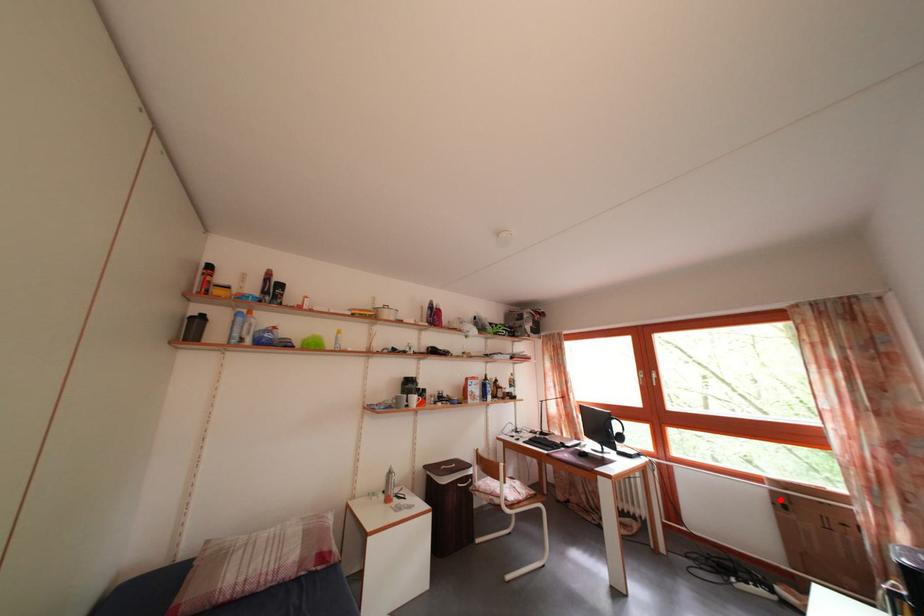
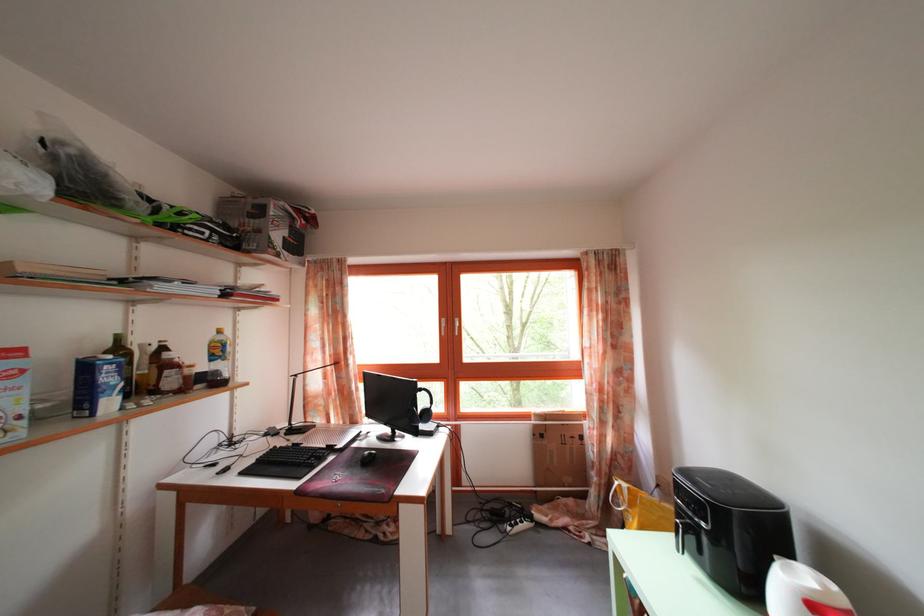
Find the pixel in the second image that matches the highlighted location in the first image.

(542, 432)